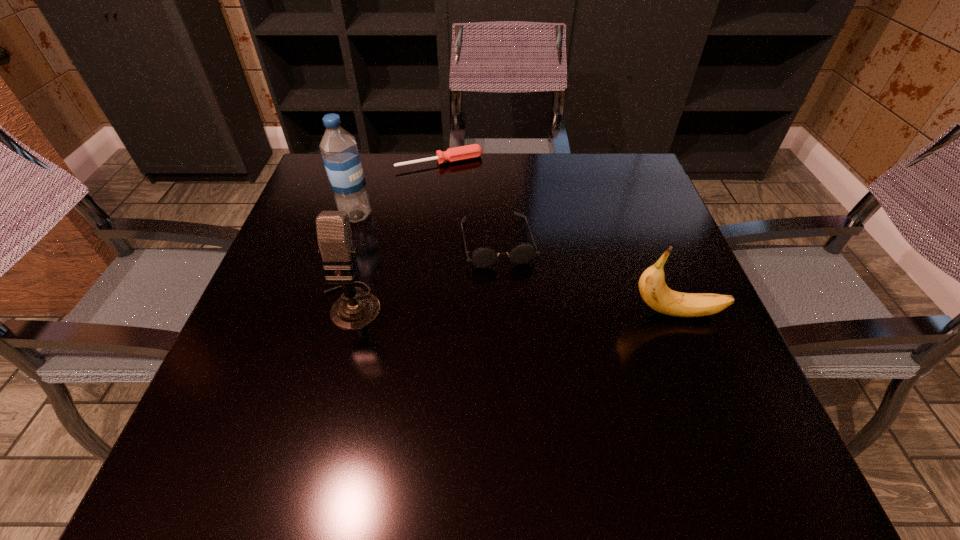
This screenshot has width=960, height=540. I want to click on free spot located on the label of the water bottle, so click(463, 277).

In order to click on free space located 0.350m on the label of the water bottle in this screenshot , I will do `click(482, 287)`.

The height and width of the screenshot is (540, 960). In order to click on vacant space located on the label of the water bottle in this screenshot , I will do `click(409, 246)`.

Identify the location of free region located on the front-facing side of the fourth tallest object. This screenshot has height=540, width=960. (526, 347).

This screenshot has height=540, width=960. What are the coordinates of `vacant space located 0.050m on the front-facing side of the fourth tallest object` in the screenshot? It's located at (510, 288).

Locate an element on the screen. This screenshot has width=960, height=540. free location located on the front-facing side of the fourth tallest object is located at coordinates (514, 302).

At what (x,y) coordinates should I click in order to perform the action: click on object located at the far edge. Please return your answer as a coordinate pair (x, y). Looking at the image, I should click on (455, 154).

Locate an element on the screen. The height and width of the screenshot is (540, 960). microphone situated at the left edge is located at coordinates (355, 309).

I want to click on water bottle located in the left edge section of the desktop, so click(339, 150).

Locate an element on the screen. The image size is (960, 540). object that is positioned at the right edge is located at coordinates (652, 286).